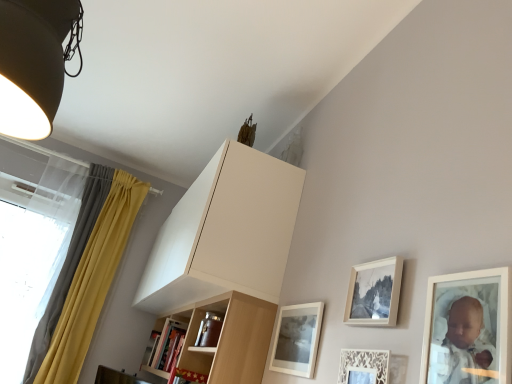
Question: From a real-world perspective, is matte black lampshade at upper left under matte white picture frame at lower center, the 4th picture frame in the front-to-back sequence?

Choices:
 (A) yes
 (B) no

Answer: (B)

Question: Is matte black lampshade at upper left at the left side of matte white picture frame at lower center, which is the first picture frame in back-to-front order?

Choices:
 (A) yes
 (B) no

Answer: (A)

Question: Considering the relative sizes of matte black lampshade at upper left and matte white picture frame at lower center, the 4th picture frame in the front-to-back sequence, in the image provided, is matte black lampshade at upper left wider than matte white picture frame at lower center, the 4th picture frame in the front-to-back sequence,?

Choices:
 (A) yes
 (B) no

Answer: (A)

Question: Can you confirm if matte black lampshade at upper left is positioned to the right of matte white picture frame at lower center, which is the first picture frame in back-to-front order?

Choices:
 (A) no
 (B) yes

Answer: (A)

Question: Is matte black lampshade at upper left located outside matte white picture frame at lower center, the 4th picture frame in the front-to-back sequence?

Choices:
 (A) yes
 (B) no

Answer: (A)

Question: Would you say matte black lampshade at upper left is a long distance from matte white picture frame at lower center, which is the first picture frame in back-to-front order?

Choices:
 (A) no
 (B) yes

Answer: (B)

Question: Is white lace picture frame at lower right, which is counted as the 3th picture frame, starting from the back, at the left side of translucent fabric at left?

Choices:
 (A) no
 (B) yes

Answer: (A)

Question: Is white lace picture frame at lower right, which is counted as the 3th picture frame, starting from the back, outside translucent fabric at left?

Choices:
 (A) no
 (B) yes

Answer: (B)

Question: Is white lace picture frame at lower right, the 2th picture frame in the front-to-back sequence, next to translucent fabric at left?

Choices:
 (A) no
 (B) yes

Answer: (A)

Question: Is white lace picture frame at lower right, which is counted as the 3th picture frame, starting from the back, wider than translucent fabric at left?

Choices:
 (A) no
 (B) yes

Answer: (A)

Question: Is white lace picture frame at lower right, the 2th picture frame in the front-to-back sequence, facing away from translucent fabric at left?

Choices:
 (A) yes
 (B) no

Answer: (B)

Question: Is translucent fabric at left inside white lace picture frame at lower right, which is counted as the 3th picture frame, starting from the back?

Choices:
 (A) yes
 (B) no

Answer: (B)

Question: Can you confirm if matte white picture frame at upper right, the fourth picture frame from the back, is taller than white lace picture frame at lower right, which is counted as the 3th picture frame, starting from the back?

Choices:
 (A) yes
 (B) no

Answer: (B)